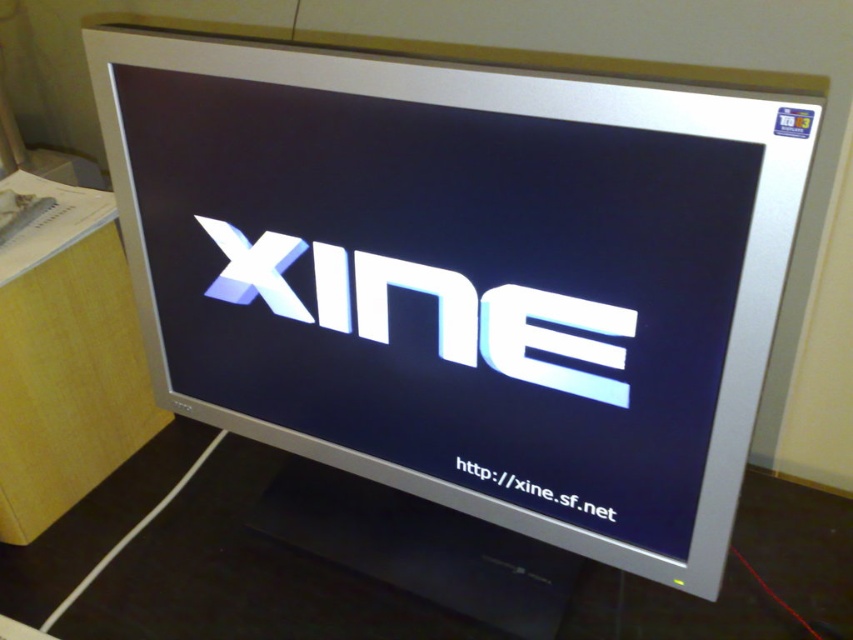
Does yellow wood table at left have a greater height compared to shiny metallic xine at center?

Indeed, yellow wood table at left has a greater height compared to shiny metallic xine at center.

Can you confirm if yellow wood table at left is positioned below shiny metallic xine at center?

Indeed, yellow wood table at left is positioned under shiny metallic xine at center.

Who is more distant from viewer, (94, 198) or (509, 353)?

The point (94, 198) is behind.

In order to click on yellow wood table at left in this screenshot , I will do click(x=67, y=358).

Who is taller, yellow wood table at left or white glossy text at center?

Standing taller between the two is yellow wood table at left.

Does yellow wood table at left have a greater width compared to white glossy text at center?

Yes, yellow wood table at left is wider than white glossy text at center.

Is point (62, 200) behind point (541, 484)?

Yes, it is.

Where is `yellow wood table at left`? The width and height of the screenshot is (853, 640). yellow wood table at left is located at coordinates (67, 358).

Does shiny metallic xine at center have a greater height compared to white glossy text at center?

Correct, shiny metallic xine at center is much taller as white glossy text at center.

Is point (247, 273) less distant than point (471, 465)?

No, (247, 273) is further to viewer.

Identify the location of shiny metallic xine at center. (437, 308).